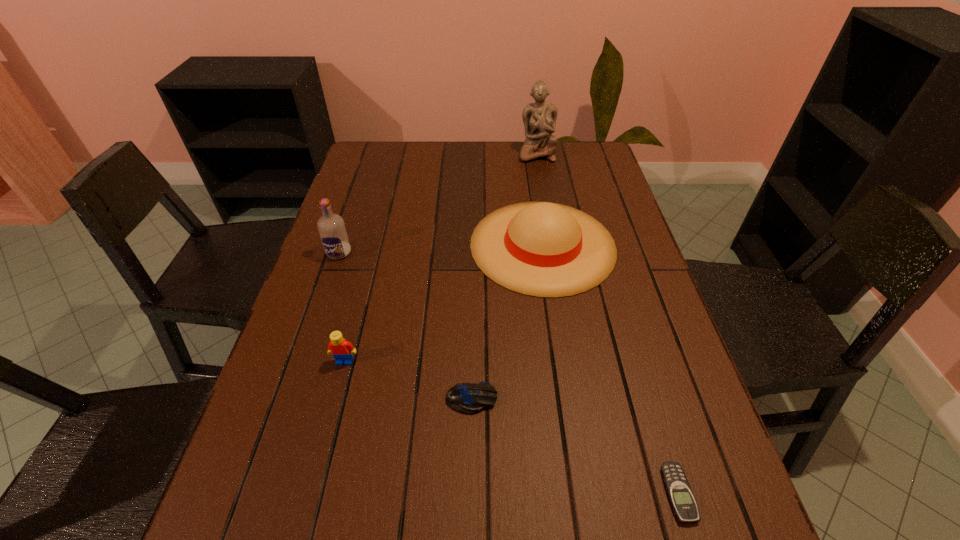
Where is `the shortest object`? The width and height of the screenshot is (960, 540). the shortest object is located at coordinates (679, 492).

Find the location of `vacant space located on the front-facing side of the farthest object`. vacant space located on the front-facing side of the farthest object is located at coordinates (547, 218).

Where is `vacant point located 0.280m on the label of the leftmost object`? vacant point located 0.280m on the label of the leftmost object is located at coordinates (307, 347).

Where is `free spot located on the left of the third tallest object`? free spot located on the left of the third tallest object is located at coordinates (370, 245).

This screenshot has width=960, height=540. In order to click on vacant space located on the face of the Lego in this screenshot , I will do `click(323, 448)`.

Locate an element on the screen. This screenshot has width=960, height=540. vacant space located on the button side of the computer mouse is located at coordinates (621, 399).

The width and height of the screenshot is (960, 540). In order to click on vacant space located 0.140m on the back of the nearest object in this screenshot , I will do `click(649, 395)`.

The width and height of the screenshot is (960, 540). Find the location of `object present at the far edge`. object present at the far edge is located at coordinates (539, 118).

Find the location of a particular element. vodka that is positioned at the left edge is located at coordinates (332, 231).

Image resolution: width=960 pixels, height=540 pixels. What are the coordinates of `Lego positioned at the left edge` in the screenshot? It's located at pyautogui.click(x=341, y=350).